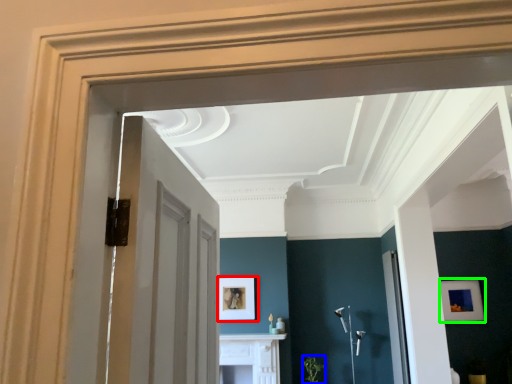
Question: Which object is positioned farthest from picture frame (highlighted by a red box)? Select from plant (highlighted by a blue box) and picture frame (highlighted by a green box).

Choices:
 (A) plant
 (B) picture frame

Answer: (B)